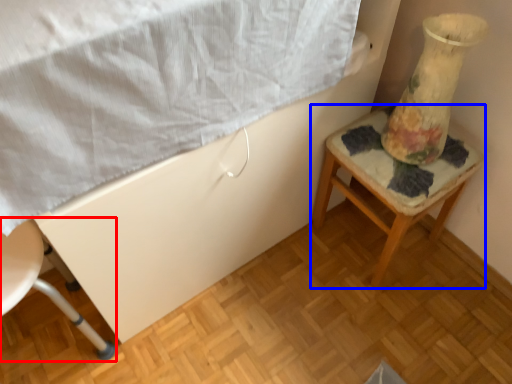
Question: Among these objects, which one is nearest to the camera, chair (highlighted by a red box) or furniture (highlighted by a blue box)?

Choices:
 (A) chair
 (B) furniture

Answer: (A)